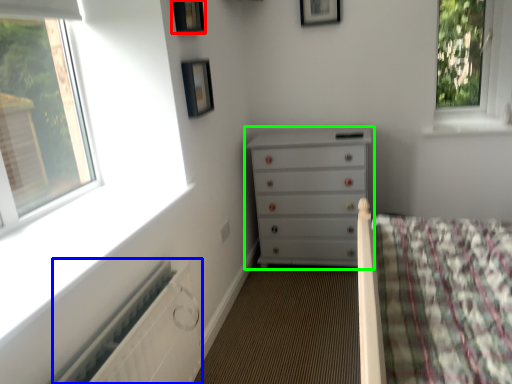
Question: Which object is the closest to the picture frame (highlighted by a red box)? Choose among these: radiator (highlighted by a blue box) or chest of drawers (highlighted by a green box).

Choices:
 (A) radiator
 (B) chest of drawers

Answer: (B)